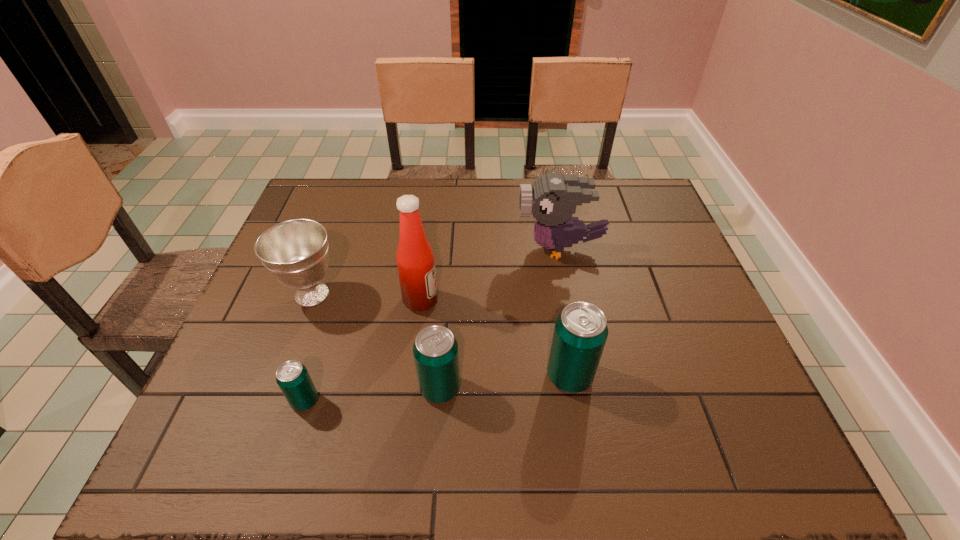
This screenshot has width=960, height=540. I want to click on vacant space at the far right corner, so click(602, 183).

Where is `vacant area that lies between the farthest object and the leftmost beer can`? vacant area that lies between the farthest object and the leftmost beer can is located at coordinates click(x=432, y=325).

The width and height of the screenshot is (960, 540). What are the coordinates of `blank region between the bird and the tallest object` in the screenshot? It's located at (491, 274).

Locate an element on the screen. free point between the shortest beer can and the farthest object is located at coordinates (432, 325).

Where is `free space between the shortest beer can and the second tallest beer can`? Image resolution: width=960 pixels, height=540 pixels. free space between the shortest beer can and the second tallest beer can is located at coordinates (372, 394).

This screenshot has width=960, height=540. Identify the location of free space between the second beer can from left to right and the rightmost beer can. (505, 382).

Locate an element on the screen. The image size is (960, 540). free space between the condiment and the rightmost beer can is located at coordinates (495, 338).

Identify the location of object that can be found as the closest to the condiment. The image size is (960, 540). (295, 252).

This screenshot has width=960, height=540. Find the location of `the fifth closest object to the rightmost beer can`. the fifth closest object to the rightmost beer can is located at coordinates (295, 252).

Choose which beer can is the second nearest neighbor to the leftmost beer can. Please provide its 2D coordinates. Your answer should be formatted as a tuple, i.e. [(x, y)], where the tuple contains the x and y coordinates of a point satisfying the conditions above.

[(580, 333)]